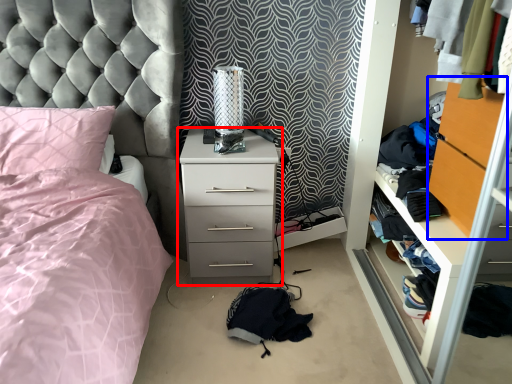
Question: Which point is closer to the camera, chest of drawers (highlighted by a red box) or file cabinet (highlighted by a blue box)?

Choices:
 (A) chest of drawers
 (B) file cabinet

Answer: (B)